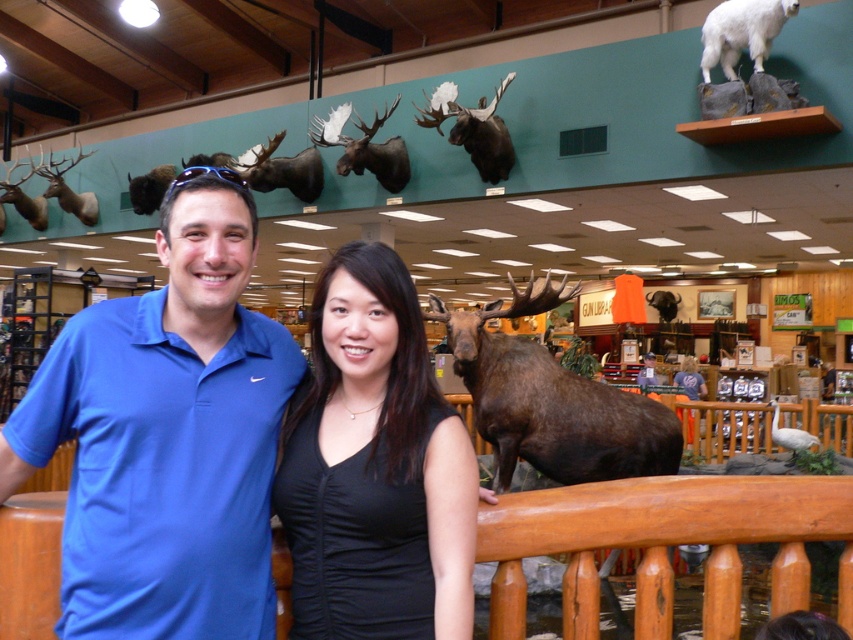
You are a customer looking to purchase a gift for a friend who loves wildlife. You see the black matte dress at center and the white feathered bird at upper right. Which item takes up more space in the store display?

The white feathered bird at upper right takes up more space in the store display than the black matte dress at center.

You are a customer in the store and want to hang both the brown matte moose head at upper center and the white feathered bird at upper right on your wall. Which one requires a larger space vertically?

The brown matte moose head at upper center requires a larger vertical space because it is much taller than the white feathered bird at upper right.